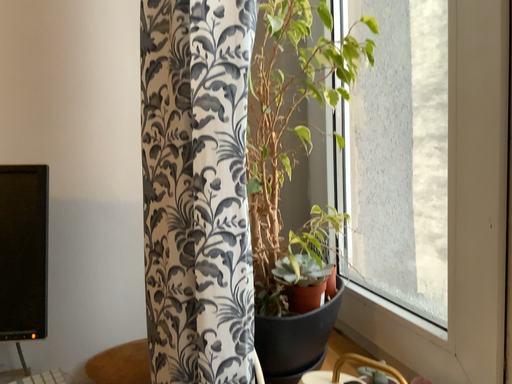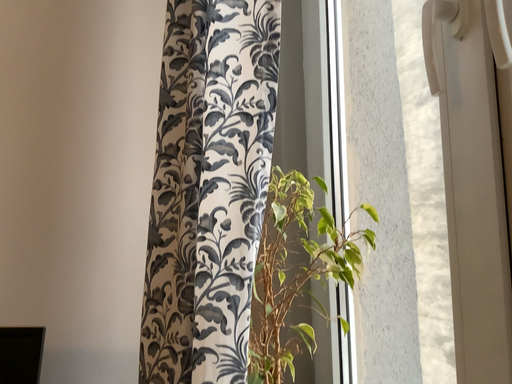
Question: Which way did the camera rotate in the video?

Choices:
 (A) rotated downward
 (B) rotated upward

Answer: (B)